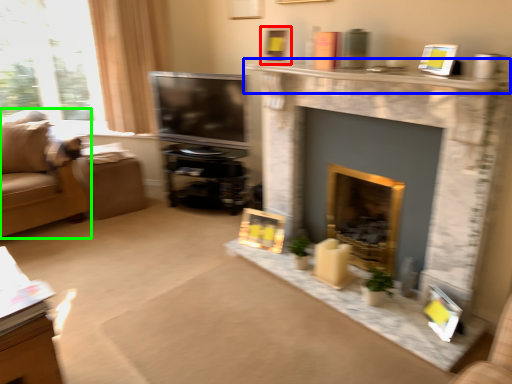
Question: Estimate the real-world distances between objects in this image. Which object is closer to picture frame (highlighted by a red box), mantle (highlighted by a blue box) or studio couch (highlighted by a green box)?

Choices:
 (A) mantle
 (B) studio couch

Answer: (A)